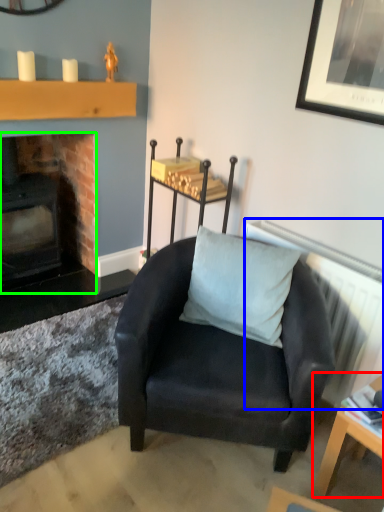
Question: Which object is positioned farthest from table (highlighted by a red box)? Select from radiator (highlighted by a blue box) and fireplace (highlighted by a green box).

Choices:
 (A) radiator
 (B) fireplace

Answer: (B)